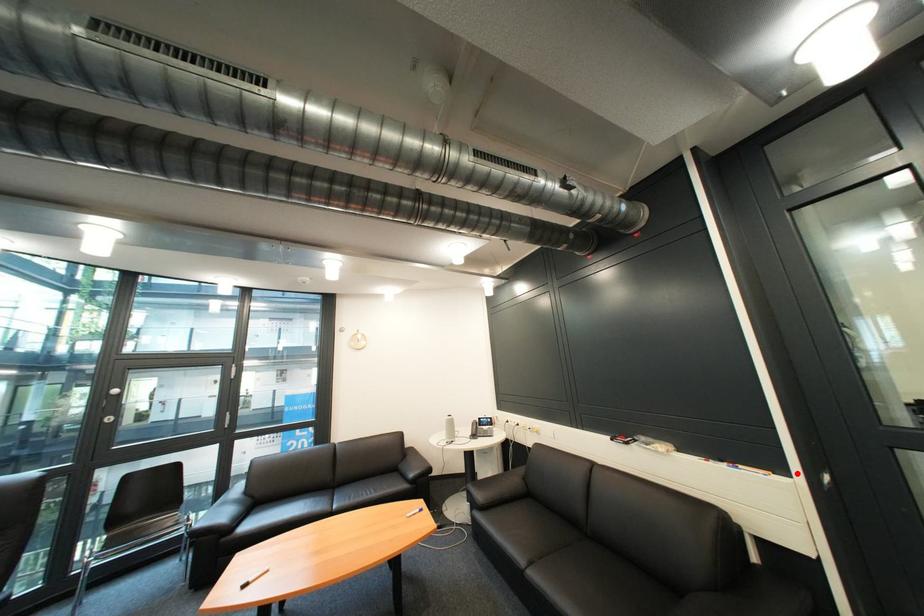
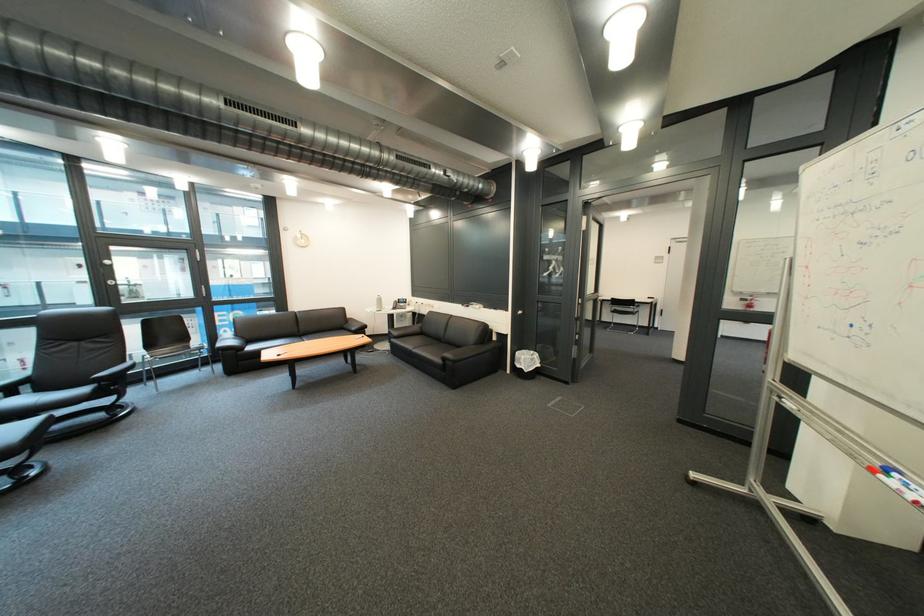
Where in the second image is the point corresponding to the highlighted location from the first image?

(520, 312)